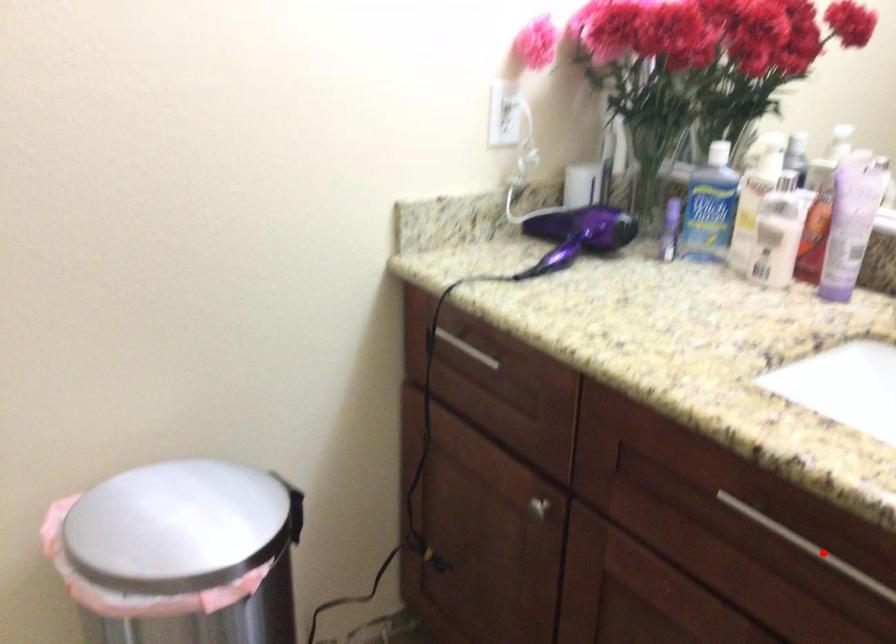
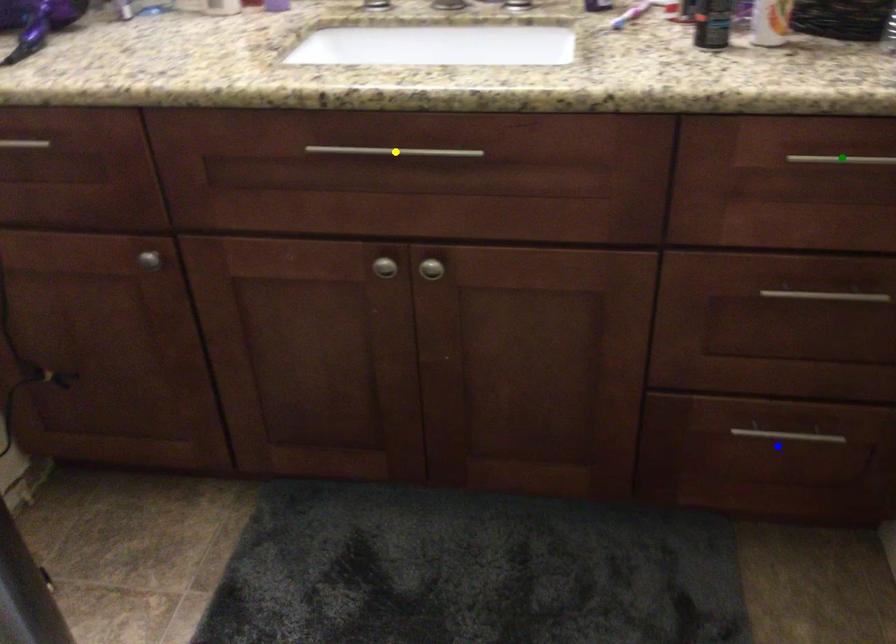
Question: I am providing you with two images of the same scene from different viewpoints. A red point is marked on the first image. You are given multiple points on the second image. Which point in image 2 represents the same 3d spot as the red point in image 1?

Choices:
 (A) yellow point
 (B) blue point
 (C) green point

Answer: (A)